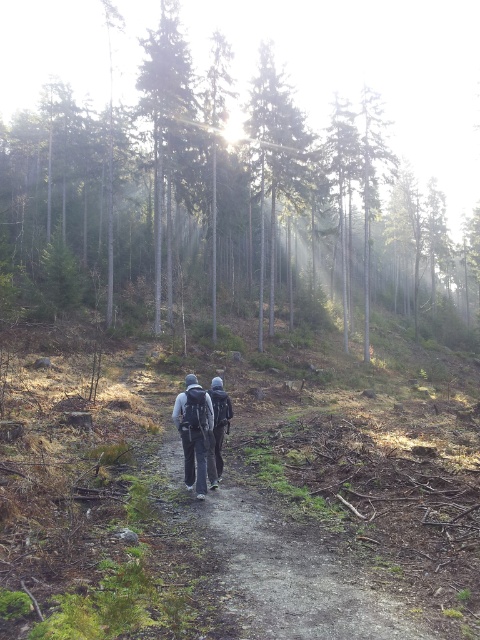
You are a hiker following the path in the forest scene. You notice two points marked on your map corresponding to coordinates point (311, 577) and point (227, 419). According to the map, which point is closer to your current position if you are walking along the path towards the direction the hikers are moving?

Point (227, 419) is closer to your current position because it is behind point (311, 577) along the path, and you are moving in the direction the hikers are going, so the point behind would be nearer to your starting point.

You are a hiker trying to follow the dirt path at center. You see the dark gray backpack at center in your way. Which direction should you move to avoid the backpack and stay on the path?

The dirt path at center is to the right of the dark gray backpack at center. To stay on the path and avoid the backpack, you should move to the right side of the backpack.

You are a hiker who wants to follow the path in the forest. You see the green matte trees at upper center and the dark gray fabric jacket at center. Which object is closer to the path you should follow?

The dark gray fabric jacket at center is closer to the path you should follow because the green matte trees at upper center are positioned to the right of the jacket, meaning the jacket is nearer to the path.